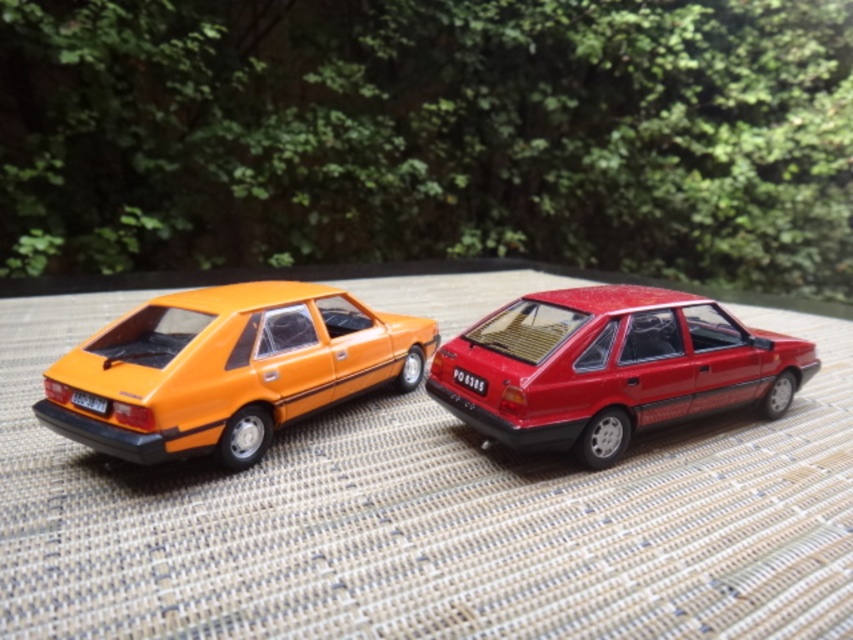
Can you confirm if glossy red car at center is positioned to the left of white plastic license plate at lower left?

Incorrect, glossy red car at center is not on the left side of white plastic license plate at lower left.

Measure the distance between glossy red car at center and camera.

They are 3.53 feet apart.

Who is more distant from viewer, (660, 307) or (76, 404)?

The point (660, 307) is more distant.

At what (x,y) coordinates should I click in order to perform the action: click on glossy red car at center. Please return your answer as a coordinate pair (x, y). The image size is (853, 640). Looking at the image, I should click on (611, 368).

Is point (96, 410) positioned after point (462, 378)?

No, it is not.

Can you confirm if white plastic license plate at lower left is positioned to the left of red plastic license plate at center?

Indeed, white plastic license plate at lower left is positioned on the left side of red plastic license plate at center.

What do you see at coordinates (90, 401) in the screenshot? The height and width of the screenshot is (640, 853). I see `white plastic license plate at lower left` at bounding box center [90, 401].

Where is `white plastic license plate at lower left`? The height and width of the screenshot is (640, 853). white plastic license plate at lower left is located at coordinates (90, 401).

Looking at this image, can you confirm if orange matte car at left is shorter than white plastic license plate at lower left?

In fact, orange matte car at left may be taller than white plastic license plate at lower left.

Does orange matte car at left have a greater height compared to white plastic license plate at lower left?

Yes.

The height and width of the screenshot is (640, 853). Find the location of `orange matte car at left`. orange matte car at left is located at coordinates (228, 369).